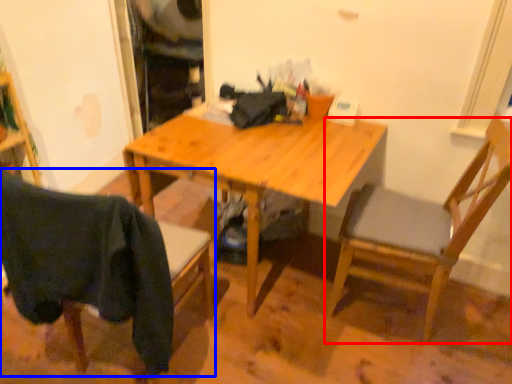
Question: Which point is closer to the camera, chair (highlighted by a red box) or chair (highlighted by a blue box)?

Choices:
 (A) chair
 (B) chair

Answer: (B)